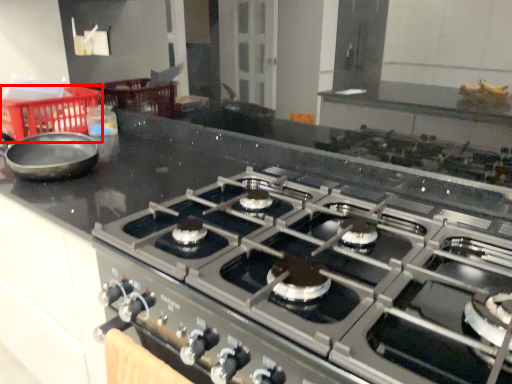
Question: In this image, where is basket (annotated by the red box) located relative to gas stove?

Choices:
 (A) left
 (B) right

Answer: (A)